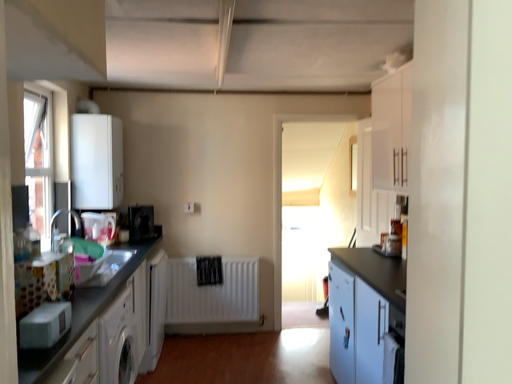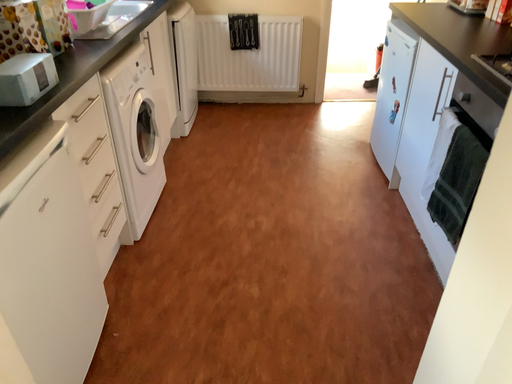
Question: How did the camera likely rotate when shooting the video?

Choices:
 (A) rotated right
 (B) rotated left

Answer: (B)